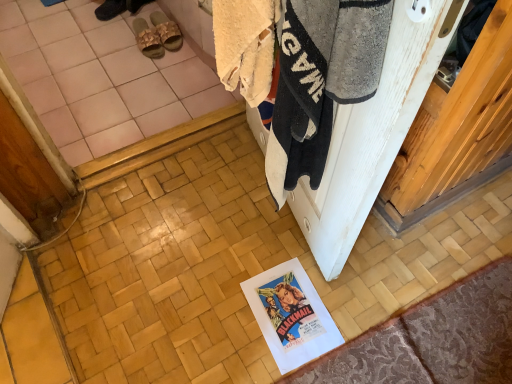
Identify the location of free space in front of beige woven slipper at upper left, the 1th footwear in the right-to-left sequence. (163, 65).